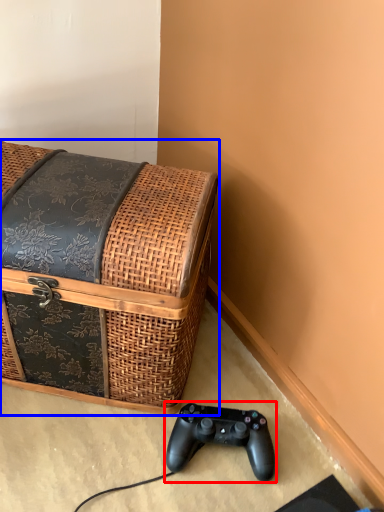
Question: Which of the following is the closest to the observer, game controller (highlighted by a red box) or furniture (highlighted by a blue box)?

Choices:
 (A) game controller
 (B) furniture

Answer: (B)